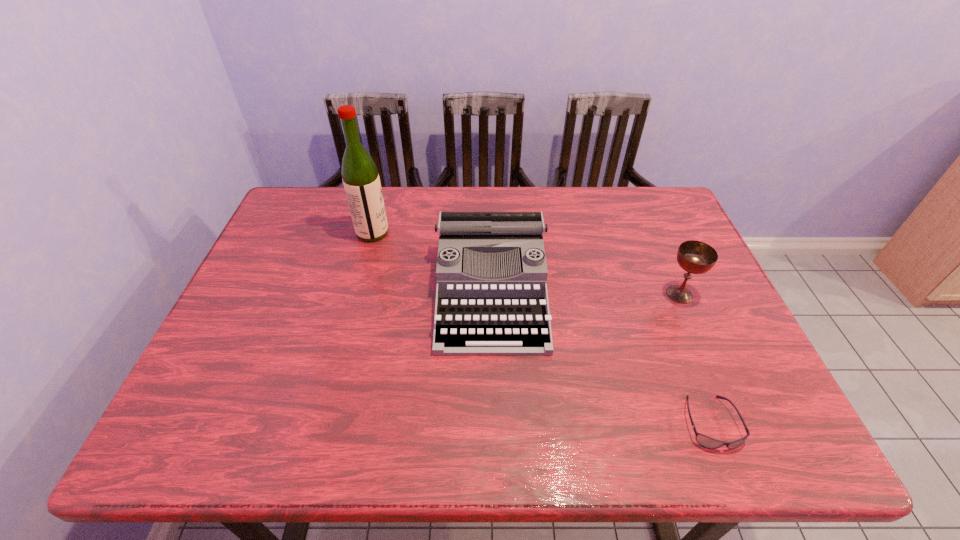
Image resolution: width=960 pixels, height=540 pixels. Find the location of `object present at the near edge`. object present at the near edge is located at coordinates (705, 441).

This screenshot has height=540, width=960. Find the location of `chalice located at the right edge`. chalice located at the right edge is located at coordinates (696, 257).

Find the location of a particular element. sunglasses at the right edge is located at coordinates tap(705, 441).

You are a GUI agent. You are given a task and a screenshot of the screen. Output one action in this format:
    pyautogui.click(x=<x>, y=<y>)
    Task: Click on the object at the near right corner
    This screenshot has height=540, width=960.
    Given the screenshot: What is the action you would take?
    pyautogui.click(x=705, y=441)

Image resolution: width=960 pixels, height=540 pixels. Find the location of `free space at the far edge of the desktop`. free space at the far edge of the desktop is located at coordinates (530, 198).

In the image, there is a desktop. Identify the location of vacant space at the near edge. The image size is (960, 540). (659, 416).

In the image, there is a desktop. Where is `vacant area at the left edge`? vacant area at the left edge is located at coordinates (193, 384).

In the image, there is a desktop. At what (x,y) coordinates should I click in order to perform the action: click on vacant space at the right edge. Please return your answer as a coordinate pair (x, y). This screenshot has width=960, height=540. Looking at the image, I should click on (746, 384).

The image size is (960, 540). In order to click on blank space at the far left corner in this screenshot , I will do `click(313, 200)`.

The width and height of the screenshot is (960, 540). Find the location of `vacant position at the near left corner of the desktop`. vacant position at the near left corner of the desktop is located at coordinates (204, 441).